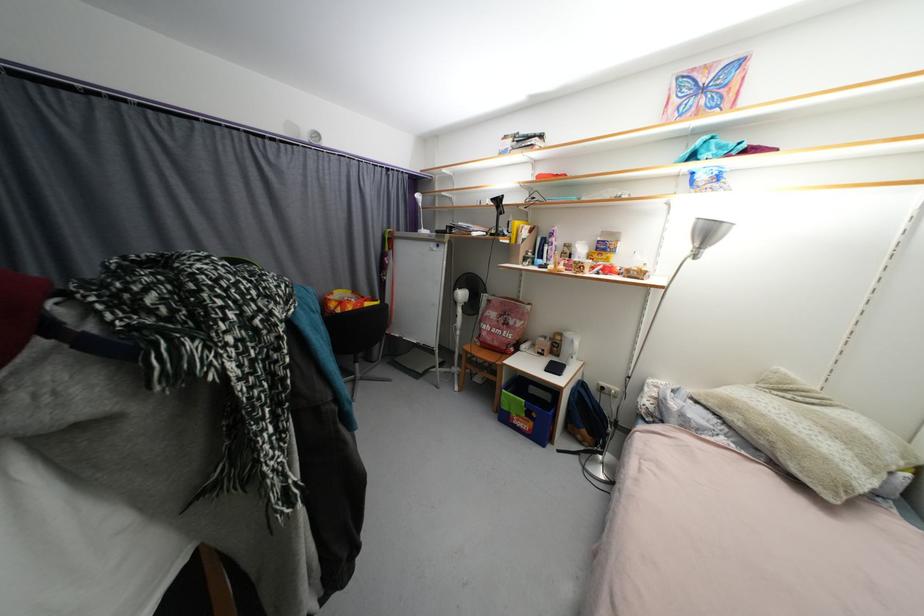
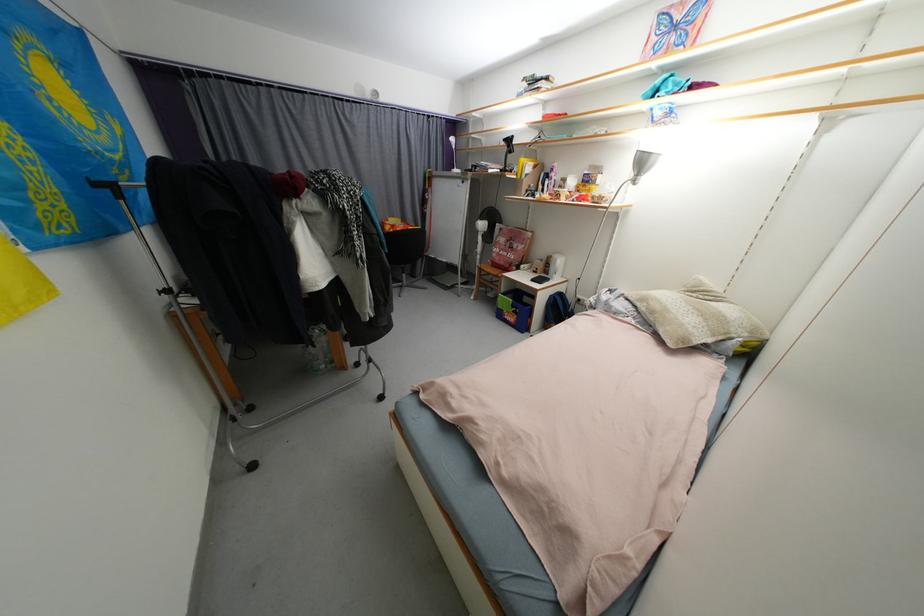
The point at [537,424] is marked in the first image. Where is the corresponding point in the second image?

(520, 318)